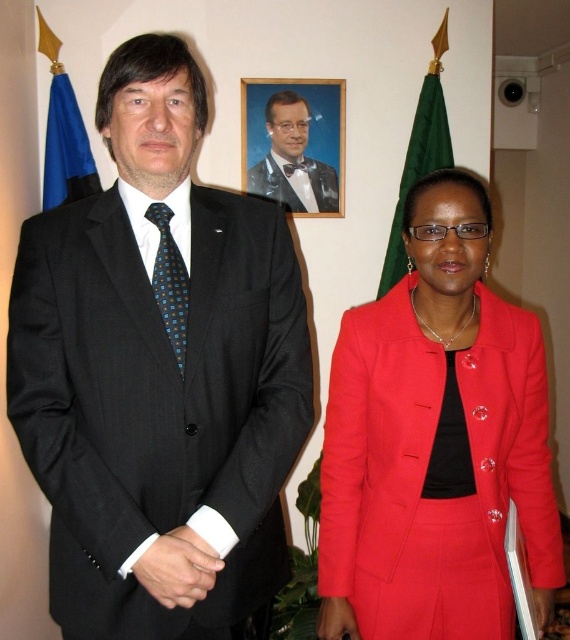
Measure the distance between point (x=176, y=390) and camera.

A distance of 1.05 meters exists between point (x=176, y=390) and camera.

Can you confirm if black pinstripe suit at left is positioned above blue fabric flag at left?

No.

Where is `black pinstripe suit at left`? This screenshot has width=570, height=640. black pinstripe suit at left is located at coordinates (158, 376).

From the picture: Between blue fabric flag at left and black satin bow tie at center, which one is positioned higher?

blue fabric flag at left is higher up.

Between point (66, 83) and point (287, 179), which one is positioned behind?

Positioned behind is point (287, 179).

Identify the location of blue fabric flag at left. (66, 148).

Where is `blue fabric flag at left`? blue fabric flag at left is located at coordinates (66, 148).

Is point (531, 550) behind point (315, 205)?

No, (531, 550) is in front of (315, 205).

Does point (393, 442) come in front of point (302, 188)?

Yes, it is in front of point (302, 188).

At what (x,y) coordinates should I click in order to perform the action: click on matte red suit at center. Please return your answer as a coordinate pair (x, y). Looking at the image, I should click on (435, 442).